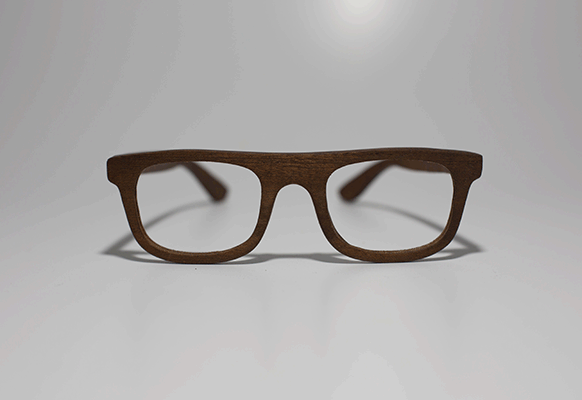
In order to click on light in this screenshot , I will do `click(413, 11)`.